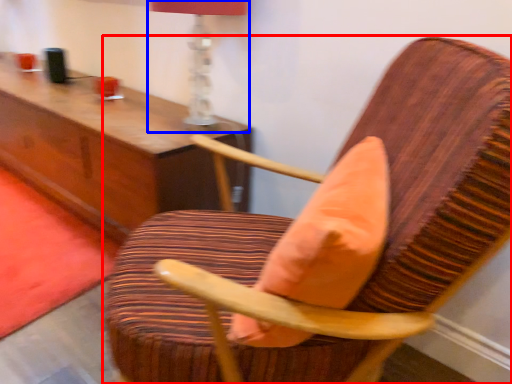
Question: Which object appears farthest to the camera in this image, chair (highlighted by a red box) or table lamp (highlighted by a blue box)?

Choices:
 (A) chair
 (B) table lamp

Answer: (B)